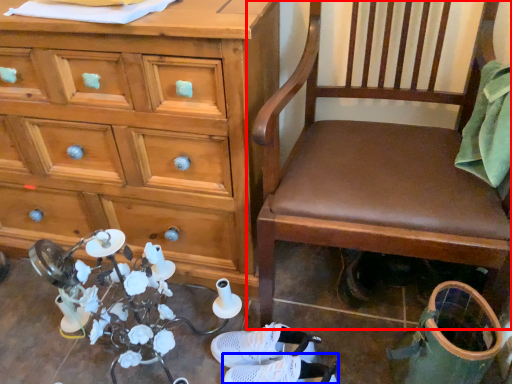
Question: Among these objects, which one is farthest to the camera, chair (highlighted by a red box) or footwear (highlighted by a blue box)?

Choices:
 (A) chair
 (B) footwear

Answer: (B)